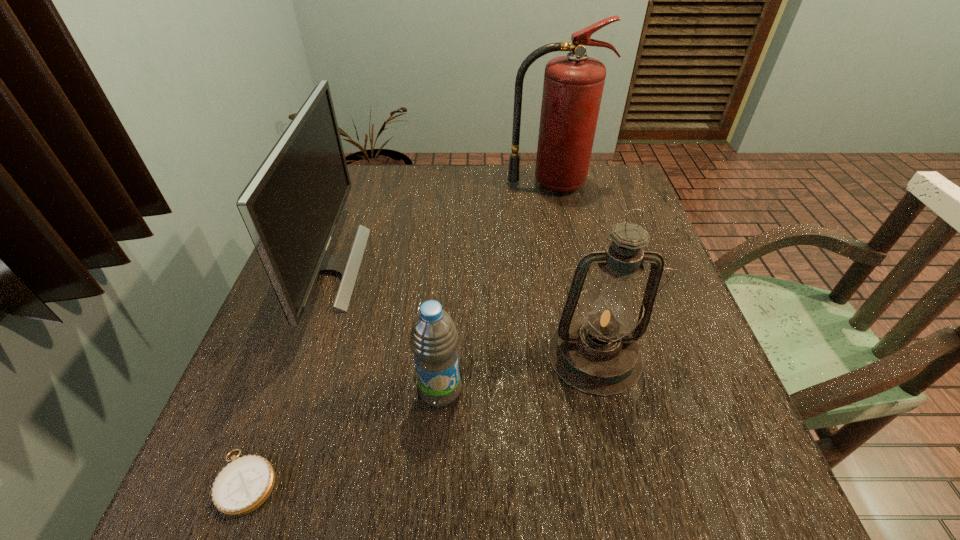
Locate an element on the screen. This screenshot has width=960, height=540. object present at the far left corner is located at coordinates (291, 206).

Identify the location of object present at the near left corner. Image resolution: width=960 pixels, height=540 pixels. (242, 486).

Identify the location of object present at the far right corner. This screenshot has width=960, height=540. (573, 85).

At what (x,y) coordinates should I click in order to perform the action: click on vacant space at the far edge. Please return your answer as a coordinate pair (x, y). This screenshot has width=960, height=540. Looking at the image, I should click on (426, 172).

In the image, there is a desktop. Where is `free space at the near edge`? free space at the near edge is located at coordinates (564, 483).

The image size is (960, 540). I want to click on vacant space at the left edge of the desktop, so point(301,381).

Find the location of a particular element. The image size is (960, 540). blank space at the right edge of the desktop is located at coordinates (663, 355).

Identify the location of vacant area at the far right corner. The image size is (960, 540). (588, 202).

Where is `blank region between the monitor and the second shortest object`? The image size is (960, 540). blank region between the monitor and the second shortest object is located at coordinates (384, 329).

Where is `empty location between the monitor and the compass`? empty location between the monitor and the compass is located at coordinates (287, 375).